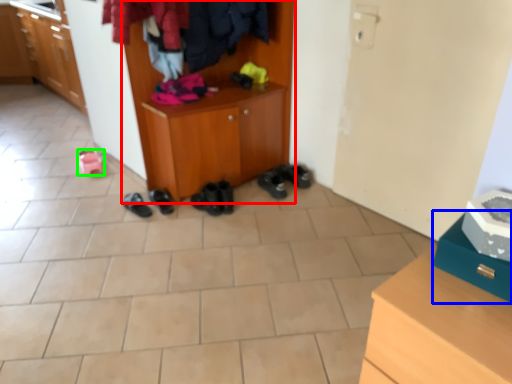
Question: Estimate the real-world distances between objects in this image. Which object is farther from cabinetry (highlighted by a red box), shoe (highlighted by a blue box) or footwear (highlighted by a green box)?

Choices:
 (A) shoe
 (B) footwear

Answer: (A)